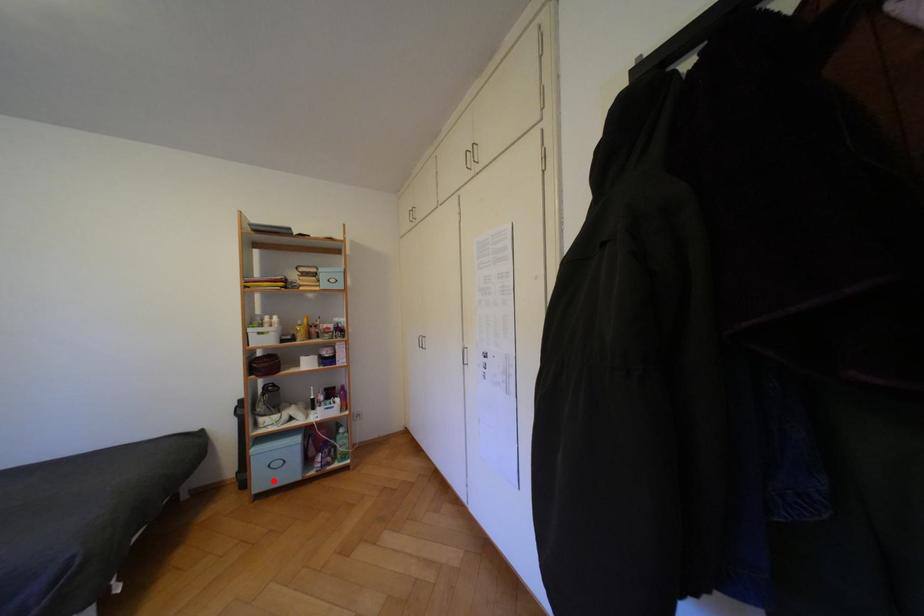
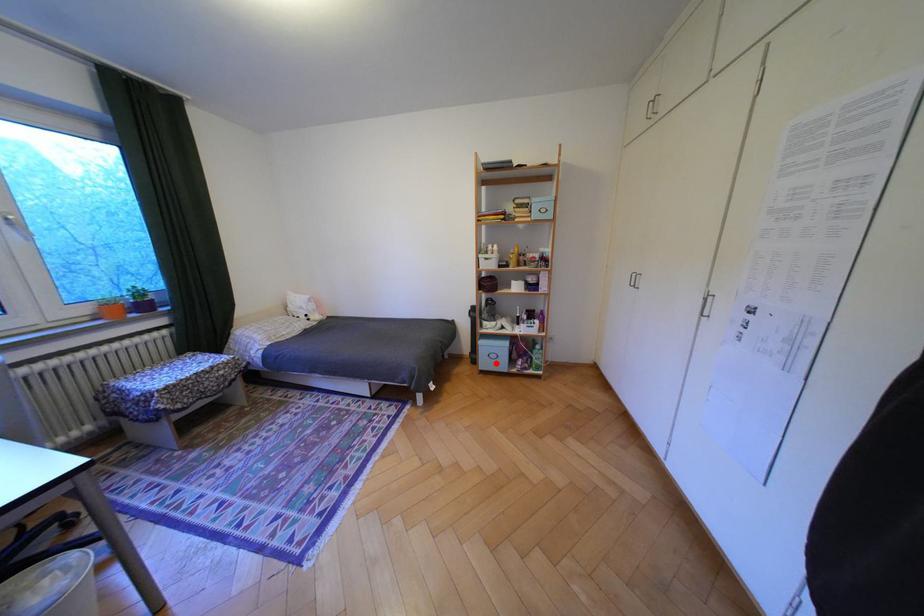
I am providing you with two images of the same scene from different viewpoints. A red point is marked on the first image and another point is marked on the second image. Do the highlighted points in image1 and image2 indicate the same real-world spot?

Yes